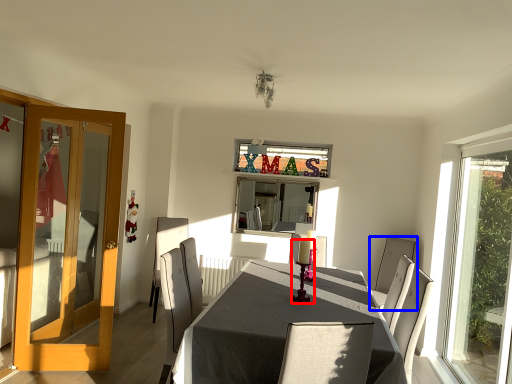
Question: Which object appears farthest to the camera in this image, candle holder (highlighted by a red box) or chair (highlighted by a blue box)?

Choices:
 (A) candle holder
 (B) chair

Answer: (B)